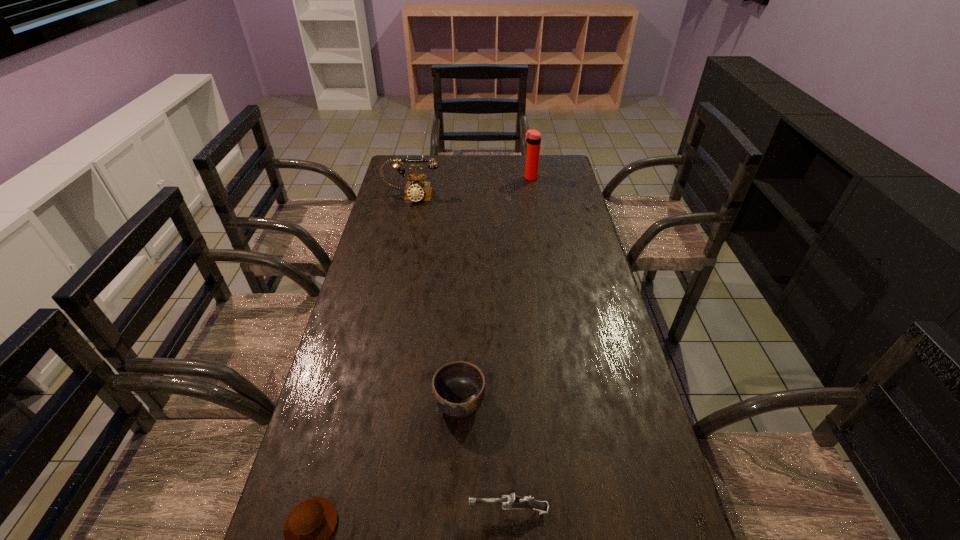
Locate an element on the screen. the farthest object is located at coordinates (533, 137).

Locate an element on the screen. The width and height of the screenshot is (960, 540). the tallest object is located at coordinates (533, 137).

The image size is (960, 540). I want to click on the second farthest object, so click(x=416, y=190).

This screenshot has width=960, height=540. What are the coordinates of `the fourth shortest object` in the screenshot? It's located at (416, 190).

Locate an element on the screen. This screenshot has height=540, width=960. bowl is located at coordinates (458, 388).

Identify the location of the third farthest object. The image size is (960, 540). (458, 388).

Locate an element on the screen. This screenshot has height=540, width=960. gun is located at coordinates (513, 501).

Locate an element on the screen. This screenshot has height=540, width=960. free region located 0.100m on the right of the farthest object is located at coordinates 561,178.

This screenshot has width=960, height=540. In order to click on free region located 0.310m on the dial number of the telephone in this screenshot , I will do `click(398, 254)`.

Where is `free space located on the right of the bowl`? The image size is (960, 540). free space located on the right of the bowl is located at coordinates (510, 403).